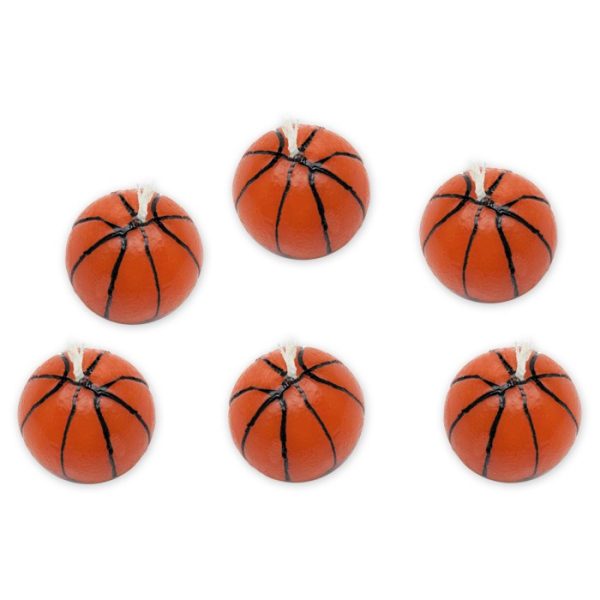
Identify the location of candles. Image resolution: width=600 pixels, height=600 pixels. (481, 260), (319, 219), (174, 272), (301, 427), (139, 423), (504, 418).